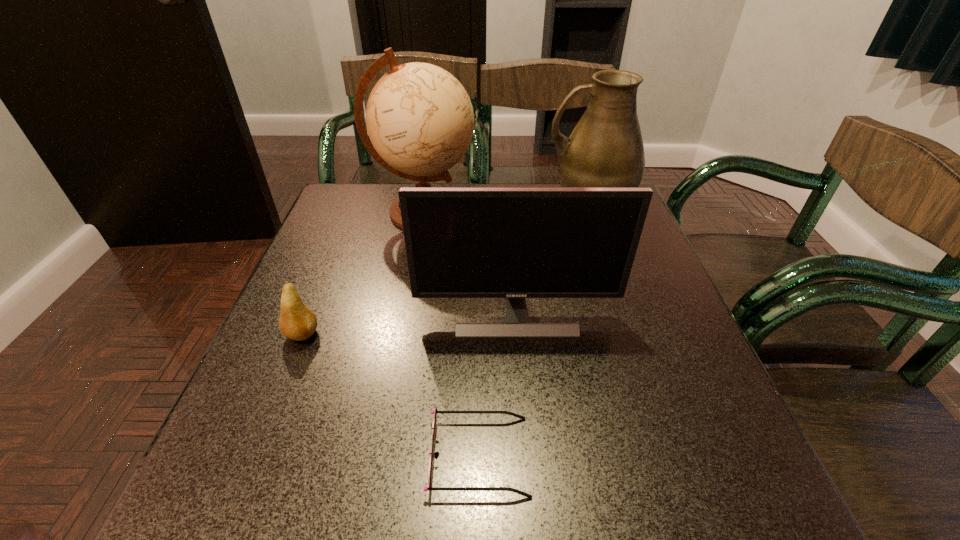
I want to click on monitor that is at the right edge, so click(514, 243).

Locate an element on the screen. The width and height of the screenshot is (960, 540). object located in the far left corner section of the desktop is located at coordinates (420, 120).

This screenshot has height=540, width=960. What are the coordinates of `object at the far right corner` in the screenshot? It's located at (605, 149).

The width and height of the screenshot is (960, 540). Find the location of `free space at the left edge of the desktop`. free space at the left edge of the desktop is located at coordinates (323, 322).

Locate an element on the screen. vacant space at the right edge of the desktop is located at coordinates (614, 351).

Locate an element on the screen. This screenshot has height=540, width=960. vacant point at the far left corner is located at coordinates (373, 206).

The width and height of the screenshot is (960, 540). Find the location of `vacant region at the near left corner of the desktop`. vacant region at the near left corner of the desktop is located at coordinates (280, 522).

Locate an element on the screen. This screenshot has width=960, height=540. vacant space that's between the nearest object and the tallest object is located at coordinates (451, 334).

What are the coordinates of `free spot between the nearest object and the third shortest object` in the screenshot? It's located at pos(497,384).

Find the location of a particular element. This screenshot has width=960, height=540. empty space between the tallest object and the pear is located at coordinates (363, 273).